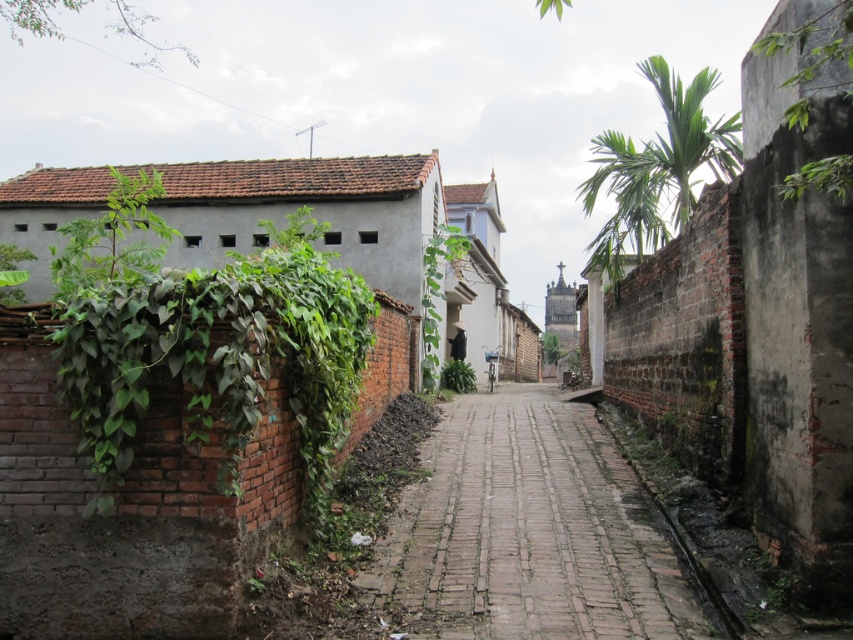
Question: Based on their relative distances, which object is nearer to the green leafy vines at left?

Choices:
 (A) brick paved path at center
 (B) green leafy plant at center

Answer: (A)

Question: Observing the image, what is the correct spatial positioning of green leafy vines at left in reference to green leafy palm at upper right?

Choices:
 (A) below
 (B) above

Answer: (A)

Question: Is green leafy vines at left to the right of green leafy plant at center from the viewer's perspective?

Choices:
 (A) no
 (B) yes

Answer: (A)

Question: Can you confirm if green leafy vines at left is thinner than green leafy palm at upper right?

Choices:
 (A) no
 (B) yes

Answer: (B)

Question: Which point is closer to the camera?

Choices:
 (A) green leafy vines at left
 (B) green leafy plant at center
 (C) green leafy palm at upper right

Answer: (A)

Question: Among these objects, which one is nearest to the camera?

Choices:
 (A) green leafy vines at left
 (B) green leafy palm at upper right
 (C) green leafy plant at center
 (D) brick paved path at center

Answer: (A)